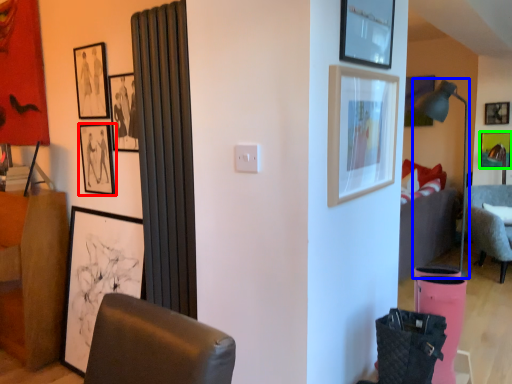
Question: Which object is the closest to the picture frame (highlighted by a red box)? Choose among these: lamp (highlighted by a blue box) or picture frame (highlighted by a green box).

Choices:
 (A) lamp
 (B) picture frame

Answer: (A)